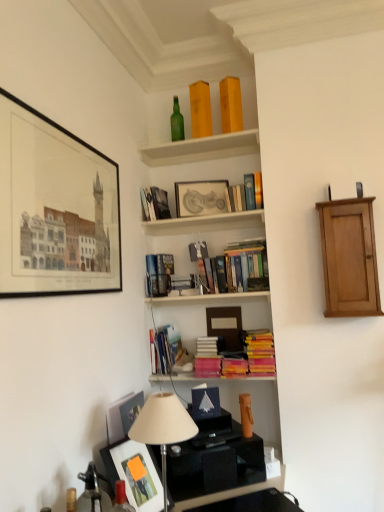
Question: Does hardcover books at center, which ranks as the 2th book in bottom-to-top order, have a lesser height compared to matte black picture frame at upper left, the 1th picture frame viewed from the left?

Choices:
 (A) yes
 (B) no

Answer: (A)

Question: From a real-world perspective, is hardcover books at center, which is counted as the ninth book, starting from the top, located higher than matte black picture frame at upper left, the 1th picture frame viewed from the left?

Choices:
 (A) yes
 (B) no

Answer: (B)

Question: Is hardcover books at center, which ranks as the 2th book in bottom-to-top order, facing towards matte black picture frame at upper left, the 1th picture frame viewed from the left?

Choices:
 (A) yes
 (B) no

Answer: (B)

Question: Does hardcover books at center, which ranks as the 2th book in bottom-to-top order, appear on the left side of matte black picture frame at upper left, which ranks as the 1th picture frame in front-to-back order?

Choices:
 (A) no
 (B) yes

Answer: (A)

Question: From the image's perspective, is hardcover books at center, which ranks as the 2th book in bottom-to-top order, on top of matte black picture frame at upper left, the second picture frame when ordered from right to left?

Choices:
 (A) no
 (B) yes

Answer: (A)

Question: Based on their sizes in the image, would you say hardcover book at upper center, which is the 7th book in bottom-to-top order, is bigger or smaller than matte black picture frame at upper left, the 1th picture frame viewed from the left?

Choices:
 (A) big
 (B) small

Answer: (B)

Question: Is hardcover book at upper center, which is the 7th book in bottom-to-top order, wider or thinner than matte black picture frame at upper left, positioned as the second picture frame in back-to-front order?

Choices:
 (A) thin
 (B) wide

Answer: (B)

Question: Would you say hardcover book at upper center, which is the 7th book in bottom-to-top order, is inside or outside matte black picture frame at upper left, positioned as the second picture frame in back-to-front order?

Choices:
 (A) inside
 (B) outside

Answer: (B)

Question: Considering the relative positions of hardcover book at upper center, the fourth book positioned from the top, and matte black picture frame at upper left, the 1th picture frame viewed from the left, in the image provided, is hardcover book at upper center, the fourth book positioned from the top, to the left or to the right of matte black picture frame at upper left, the 1th picture frame viewed from the left,?

Choices:
 (A) right
 (B) left

Answer: (A)

Question: Based on their positions, is wooden books at center, which is counted as the 1th shelf, starting from the bottom, located to the left or right of hardcover books at center, the fifth book positioned from the bottom?

Choices:
 (A) right
 (B) left

Answer: (B)

Question: From a real-world perspective, relative to hardcover books at center, the fifth book positioned from the bottom, is wooden books at center, which is counted as the 1th shelf, starting from the bottom, vertically above or below?

Choices:
 (A) above
 (B) below

Answer: (A)

Question: Considering their positions, is wooden books at center, the second shelf in the top-to-bottom sequence, located in front of or behind hardcover books at center, which is the 6th book from top to bottom?

Choices:
 (A) front
 (B) behind

Answer: (B)

Question: Based on their sizes in the image, would you say wooden books at center, which is counted as the 1th shelf, starting from the bottom, is bigger or smaller than hardcover books at center, which is the 6th book from top to bottom?

Choices:
 (A) small
 (B) big

Answer: (A)

Question: Does point (180, 346) appear closer or farther from the camera than point (155, 187)?

Choices:
 (A) closer
 (B) farther

Answer: (A)

Question: Considering the positions of hardcover books at center, which ranks as the 2th book in bottom-to-top order, and hardcover book at upper center, which is the 7th book in bottom-to-top order, in the image, is hardcover books at center, which ranks as the 2th book in bottom-to-top order, taller or shorter than hardcover book at upper center, which is the 7th book in bottom-to-top order,?

Choices:
 (A) tall
 (B) short

Answer: (A)